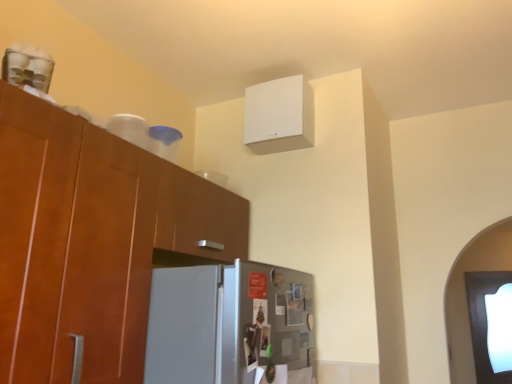
Question: Should I look upward or downward to see transparent glass door at lower right?

Choices:
 (A) up
 (B) down

Answer: (B)